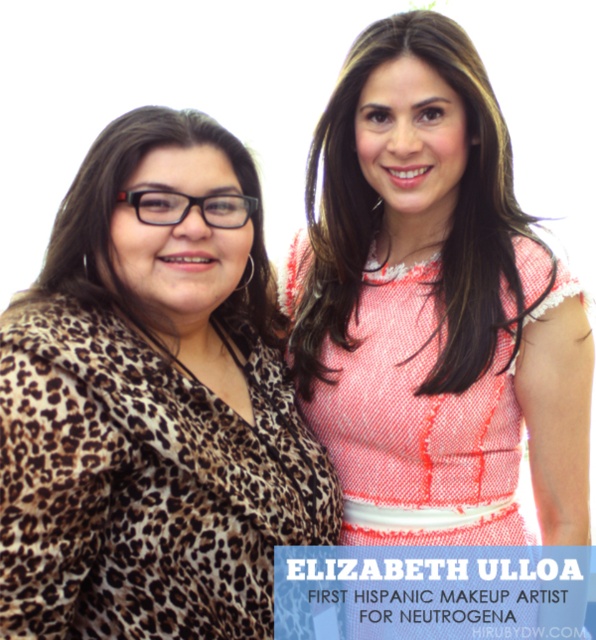
Question: Does leopard print coat at left have a smaller size compared to pink textured dress at center?

Choices:
 (A) yes
 (B) no

Answer: (B)

Question: Observing the image, what is the correct spatial positioning of leopard print coat at left in reference to pink textured dress at center?

Choices:
 (A) below
 (B) above

Answer: (A)

Question: Which of the following is the farthest from the observer?

Choices:
 (A) pink textured dress at center
 (B) leopard print coat at left

Answer: (A)

Question: Among these points, which one is farthest from the camera?

Choices:
 (A) (38, 365)
 (B) (412, 513)

Answer: (B)

Question: Is leopard print coat at left below pink textured dress at center?

Choices:
 (A) yes
 (B) no

Answer: (A)

Question: Which of the following is the farthest from the observer?

Choices:
 (A) leopard print coat at left
 (B) pink textured dress at center

Answer: (B)